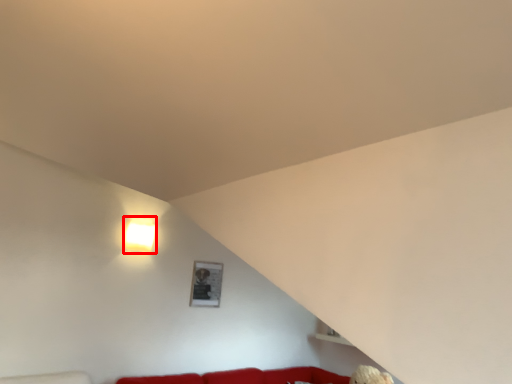
Question: Observing the image, what is the correct spatial positioning of lamp (annotated by the red box) in reference to picture frame?

Choices:
 (A) right
 (B) left

Answer: (B)